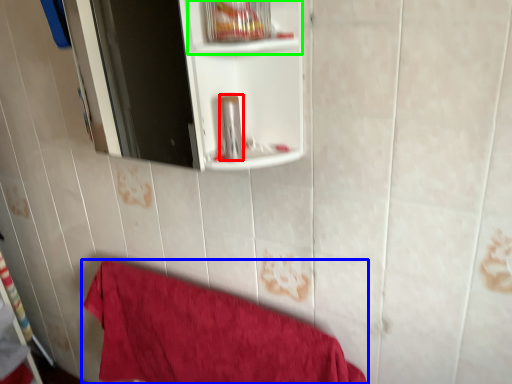
Question: Which is farther away from toiletry (highlighted by a red box)? towel (highlighted by a blue box) or cabinet (highlighted by a green box)?

Choices:
 (A) towel
 (B) cabinet

Answer: (A)